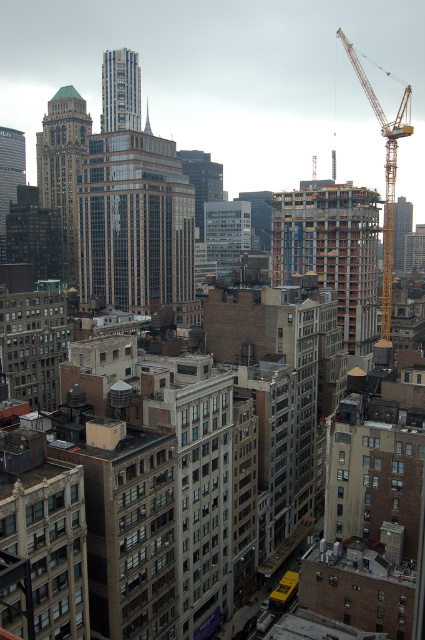
Question: Can you confirm if red brick construction at center is bigger than gold/brass/textured building at center?

Choices:
 (A) yes
 (B) no

Answer: (A)

Question: Which of the following is the farthest from the observer?

Choices:
 (A) yellow metallic crane at right
 (B) gold/brass/textured building at center

Answer: (B)

Question: Does red brick construction at center have a lesser width compared to gold/brass/textured building at center?

Choices:
 (A) no
 (B) yes

Answer: (A)

Question: Among these objects, which one is farthest from the camera?

Choices:
 (A) gold reflective glass skyscraper at upper center
 (B) glassy reflective skyscraper at center
 (C) red brick construction at center

Answer: (A)

Question: Can you confirm if glassy reflective skyscraper at center is positioned to the left of red brick construction at center?

Choices:
 (A) yes
 (B) no

Answer: (A)

Question: Which of the following is the closest to the observer?

Choices:
 (A) pos(163,289)
 (B) pos(56,116)
 (C) pos(133,56)

Answer: (A)